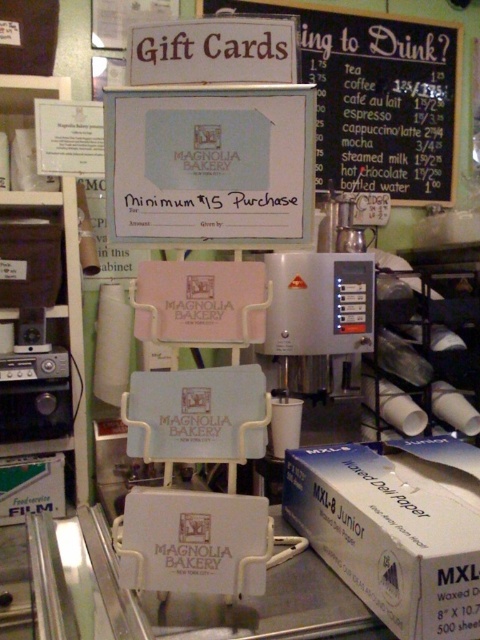
You are a customer standing in front of the Magnolia Bakery display. You want to place your coffee cup on a surface between the black chalkboard at upper center and the satin silver machine at center. Is there enough space between them to place your coffee cup?

The black chalkboard at upper center and the satin silver machine at center are 32.05 inches apart, so yes, there is enough space between them to place your coffee cup.

You are a customer looking at the items in Magnolia Bakery. You notice the waxed paper at lower right and the black chalkboard at upper center. Which of these two items is taller?

The black chalkboard at upper center is taller than the waxed paper at lower right.

You are standing in the bakery and want to place a new menu board between the two points, point (402, 550) and point (349, 259). According to the scene description, which point should the menu board be closer to?

The menu board should be closer to point (349, 259) because point (402, 550) is in front of point (349, 259), meaning the latter is further back.